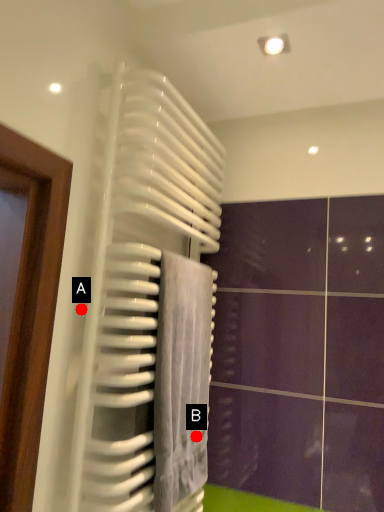
Question: Two points are circled on the image, labeled by A and B beside each circle. Which point is closer to the camera taking this photo?

Choices:
 (A) A is closer
 (B) B is closer

Answer: (A)